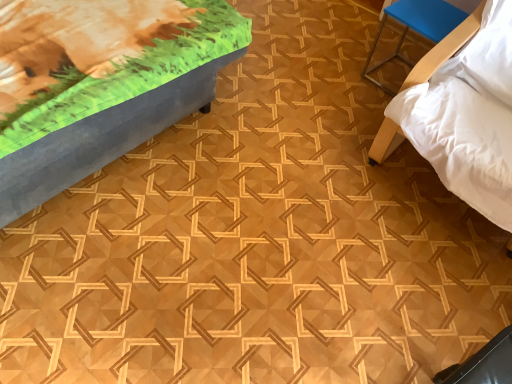
Measure the distance between point (x=411, y=10) and camera.

Point (x=411, y=10) is 1.80 meters from camera.

This screenshot has width=512, height=384. What do you see at coordinates (415, 28) in the screenshot?
I see `blue plastic stool at upper right, marked as the second furniture in a left-to-right arrangement` at bounding box center [415, 28].

Locate an element on the screen. Image resolution: width=512 pixels, height=384 pixels. white soft bed at right, the 3th furniture from the left is located at coordinates (462, 113).

Identify the location of blue plastic stool at upper right, marked as the second furniture in a left-to-right arrangement. This screenshot has width=512, height=384. (415, 28).

From the image's perspective, relative to white soft bed at right, the first furniture from the right, is blue plastic stool at upper right, positioned as the 2th furniture in right-to-left order, above or below?

Based on their image positions, blue plastic stool at upper right, positioned as the 2th furniture in right-to-left order, is located above white soft bed at right, the first furniture from the right.

How far apart are blue plastic stool at upper right, positioned as the 2th furniture in right-to-left order, and white soft bed at right, the 3th furniture from the left?

A distance of 18.10 inches exists between blue plastic stool at upper right, positioned as the 2th furniture in right-to-left order, and white soft bed at right, the 3th furniture from the left.

From a real-world perspective, which is physically below, blue plastic stool at upper right, marked as the second furniture in a left-to-right arrangement, or white soft bed at right, the 3th furniture from the left?

In real-world perspective, blue plastic stool at upper right, marked as the second furniture in a left-to-right arrangement, is lower.

What's the angular difference between blue plastic stool at upper right, positioned as the 2th furniture in right-to-left order, and white soft bed at right, the first furniture from the right,'s facing directions?

There is a 1.98-degree angle between the facing directions of blue plastic stool at upper right, positioned as the 2th furniture in right-to-left order, and white soft bed at right, the first furniture from the right.

Considering the relative sizes of white soft bed at right, the 3th furniture from the left, and blue plastic stool at upper right, marked as the second furniture in a left-to-right arrangement, in the image provided, is white soft bed at right, the 3th furniture from the left, thinner than blue plastic stool at upper right, marked as the second furniture in a left-to-right arrangement,?

In fact, white soft bed at right, the 3th furniture from the left, might be wider than blue plastic stool at upper right, marked as the second furniture in a left-to-right arrangement.

Is white soft bed at right, the first furniture from the right, facing towards blue plastic stool at upper right, marked as the second furniture in a left-to-right arrangement?

No, white soft bed at right, the first furniture from the right, is not oriented towards blue plastic stool at upper right, marked as the second furniture in a left-to-right arrangement.

Is white soft bed at right, the first furniture from the right, smaller than blue plastic stool at upper right, positioned as the 2th furniture in right-to-left order?

No, white soft bed at right, the first furniture from the right, is not smaller than blue plastic stool at upper right, positioned as the 2th furniture in right-to-left order.

From the image's perspective, is white soft bed at right, the first furniture from the right, positioned above or below blue plastic stool at upper right, positioned as the 2th furniture in right-to-left order?

From the image's perspective, white soft bed at right, the first furniture from the right, appears below blue plastic stool at upper right, positioned as the 2th furniture in right-to-left order.

Considering the sizes of objects white soft bed at right, the 3th furniture from the left, and matte gray bench at upper left, acting as the 1th furniture starting from the left, in the image provided, who is wider, white soft bed at right, the 3th furniture from the left, or matte gray bench at upper left, acting as the 1th furniture starting from the left,?

Wider between the two is white soft bed at right, the 3th furniture from the left.

Is white soft bed at right, the 3th furniture from the left, facing away from matte gray bench at upper left, acting as the 1th furniture starting from the left?

white soft bed at right, the 3th furniture from the left, is not turned away from matte gray bench at upper left, acting as the 1th furniture starting from the left.

Would you say white soft bed at right, the 3th furniture from the left, is inside or outside matte gray bench at upper left, acting as the 1th furniture starting from the left?

white soft bed at right, the 3th furniture from the left, cannot be found inside matte gray bench at upper left, acting as the 1th furniture starting from the left.

Is there a large distance between white soft bed at right, the first furniture from the right, and matte gray bench at upper left, acting as the 1th furniture starting from the left?

That's not correct — white soft bed at right, the first furniture from the right, is a little close to matte gray bench at upper left, acting as the 1th furniture starting from the left.

Is point (381, 86) closer to camera compared to point (163, 85)?

No, (381, 86) is further to viewer.

Looking at the image, does blue plastic stool at upper right, positioned as the 2th furniture in right-to-left order, seem bigger or smaller compared to matte gray bench at upper left, marked as the 3th furniture in a right-to-left arrangement?

blue plastic stool at upper right, positioned as the 2th furniture in right-to-left order, is smaller than matte gray bench at upper left, marked as the 3th furniture in a right-to-left arrangement.

How different are the orientations of blue plastic stool at upper right, positioned as the 2th furniture in right-to-left order, and matte gray bench at upper left, acting as the 1th furniture starting from the left, in degrees?

blue plastic stool at upper right, positioned as the 2th furniture in right-to-left order, and matte gray bench at upper left, acting as the 1th furniture starting from the left, are facing 92.8 degrees away from each other.

Is blue plastic stool at upper right, marked as the second furniture in a left-to-right arrangement, looking in the opposite direction of matte gray bench at upper left, acting as the 1th furniture starting from the left?

No, blue plastic stool at upper right, marked as the second furniture in a left-to-right arrangement, is not facing away from matte gray bench at upper left, acting as the 1th furniture starting from the left.

Which of these two, matte gray bench at upper left, acting as the 1th furniture starting from the left, or white soft bed at right, the 3th furniture from the left, is bigger?

matte gray bench at upper left, acting as the 1th furniture starting from the left, is bigger.

Based on the photo, which object is further away from the camera, matte gray bench at upper left, marked as the 3th furniture in a right-to-left arrangement, or white soft bed at right, the 3th furniture from the left?

Positioned behind is white soft bed at right, the 3th furniture from the left.

Is matte gray bench at upper left, marked as the 3th furniture in a right-to-left arrangement, taller than white soft bed at right, the first furniture from the right?

In fact, matte gray bench at upper left, marked as the 3th furniture in a right-to-left arrangement, may be shorter than white soft bed at right, the first furniture from the right.

Is matte gray bench at upper left, marked as the 3th furniture in a right-to-left arrangement, positioned before blue plastic stool at upper right, marked as the second furniture in a left-to-right arrangement?

Yes, matte gray bench at upper left, marked as the 3th furniture in a right-to-left arrangement, is closer to the camera.

From a real-world perspective, which object stands above the other?

matte gray bench at upper left, acting as the 1th furniture starting from the left, from a real-world perspective.

Is matte gray bench at upper left, marked as the 3th furniture in a right-to-left arrangement, placed right next to blue plastic stool at upper right, positioned as the 2th furniture in right-to-left order?

No, matte gray bench at upper left, marked as the 3th furniture in a right-to-left arrangement, is not beside blue plastic stool at upper right, positioned as the 2th furniture in right-to-left order.

From the picture: Is matte gray bench at upper left, marked as the 3th furniture in a right-to-left arrangement, wider or thinner than blue plastic stool at upper right, positioned as the 2th furniture in right-to-left order?

Clearly, matte gray bench at upper left, marked as the 3th furniture in a right-to-left arrangement, has more width compared to blue plastic stool at upper right, positioned as the 2th furniture in right-to-left order.

Identify the location of the 2nd furniture positioned below the blue plastic stool at upper right, marked as the second furniture in a left-to-right arrangement (from the image's perspective). (462, 113).

Where is `furniture that appears behind the white soft bed at right, the 3th furniture from the left`? furniture that appears behind the white soft bed at right, the 3th furniture from the left is located at coordinates (415, 28).

Estimate the real-world distances between objects in this image. Which object is further from white soft bed at right, the 3th furniture from the left, matte gray bench at upper left, acting as the 1th furniture starting from the left, or blue plastic stool at upper right, positioned as the 2th furniture in right-to-left order?

matte gray bench at upper left, acting as the 1th furniture starting from the left.

From the image, which object appears to be farther from blue plastic stool at upper right, positioned as the 2th furniture in right-to-left order, white soft bed at right, the 3th furniture from the left, or matte gray bench at upper left, acting as the 1th furniture starting from the left?

matte gray bench at upper left, acting as the 1th furniture starting from the left.

When comparing their distances from matte gray bench at upper left, marked as the 3th furniture in a right-to-left arrangement, does blue plastic stool at upper right, marked as the second furniture in a left-to-right arrangement, or white soft bed at right, the 3th furniture from the left, seem further?

blue plastic stool at upper right, marked as the second furniture in a left-to-right arrangement, is further to matte gray bench at upper left, marked as the 3th furniture in a right-to-left arrangement.

When comparing their distances from white soft bed at right, the first furniture from the right, does blue plastic stool at upper right, positioned as the 2th furniture in right-to-left order, or matte gray bench at upper left, marked as the 3th furniture in a right-to-left arrangement, seem closer?

The object closer to white soft bed at right, the first furniture from the right, is blue plastic stool at upper right, positioned as the 2th furniture in right-to-left order.

In the scene shown: Estimate the real-world distances between objects in this image. Which object is further from matte gray bench at upper left, acting as the 1th furniture starting from the left, white soft bed at right, the 3th furniture from the left, or blue plastic stool at upper right, marked as the second furniture in a left-to-right arrangement?

blue plastic stool at upper right, marked as the second furniture in a left-to-right arrangement, lies further to matte gray bench at upper left, acting as the 1th furniture starting from the left, than the other object.

Based on their spatial positions, is matte gray bench at upper left, acting as the 1th furniture starting from the left, or white soft bed at right, the first furniture from the right, closer to blue plastic stool at upper right, marked as the second furniture in a left-to-right arrangement?

white soft bed at right, the first furniture from the right, lies closer to blue plastic stool at upper right, marked as the second furniture in a left-to-right arrangement, than the other object.

Find the location of a particular element. furniture situated between matte gray bench at upper left, marked as the 3th furniture in a right-to-left arrangement, and white soft bed at right, the first furniture from the right, from left to right is located at coordinates (415, 28).